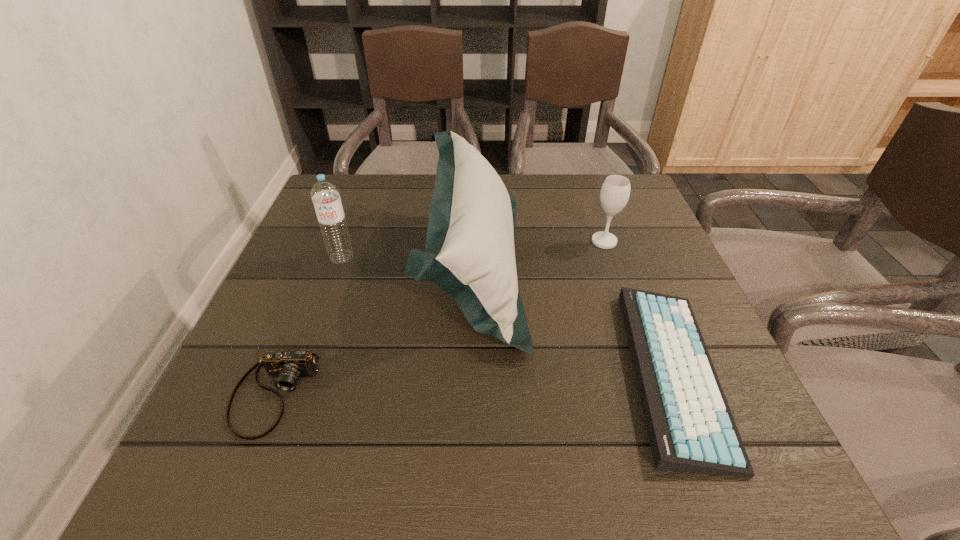
Image resolution: width=960 pixels, height=540 pixels. What are the coordinates of `cushion` in the screenshot? It's located at (469, 253).

The width and height of the screenshot is (960, 540). Identify the location of water bottle. (325, 195).

Where is `the third tallest object`? the third tallest object is located at coordinates [x=615, y=191].

The image size is (960, 540). Identify the location of the fourth tallest object. (288, 366).

Locate an element on the screen. the shortest object is located at coordinates (691, 429).

In order to click on vacant space located 0.250m on the surface of the cushion in this screenshot , I will do `click(636, 264)`.

Locate an element on the screen. vacant space situated 0.050m on the left of the water bottle is located at coordinates (307, 258).

Where is `vacant space located 0.190m on the back of the third tallest object`? Image resolution: width=960 pixels, height=540 pixels. vacant space located 0.190m on the back of the third tallest object is located at coordinates (588, 192).

Locate an element on the screen. Image resolution: width=960 pixels, height=540 pixels. vacant region located on the front-facing side of the fourth tallest object is located at coordinates (243, 473).

Where is `blank area located 0.340m on the back of the computer keyboard`? This screenshot has height=540, width=960. blank area located 0.340m on the back of the computer keyboard is located at coordinates (609, 206).